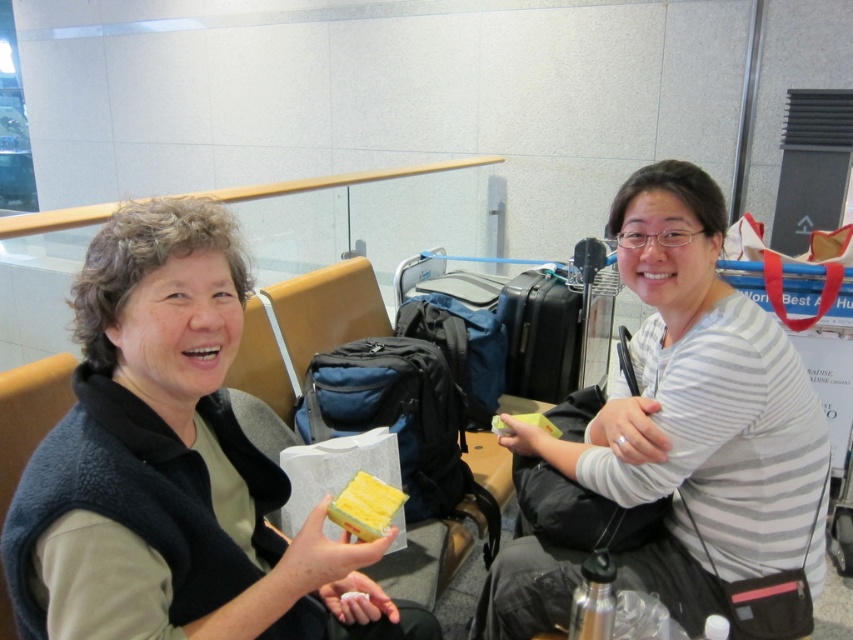
Question: Is matte black vest at left to the left of yellow matte soap at center from the viewer's perspective?

Choices:
 (A) no
 (B) yes

Answer: (B)

Question: Among these points, which one is farthest from the camera?

Choices:
 (A) (563, 346)
 (B) (585, 524)

Answer: (A)

Question: Is blue fabric backpack at center in front of yellow matte soap at center?

Choices:
 (A) no
 (B) yes

Answer: (A)

Question: Which object appears farthest from the camera in this image?

Choices:
 (A) matte black vest at left
 (B) yellow matte soap at center
 (C) black fabric backpack at right
 (D) black hard suitcase at center

Answer: (D)

Question: Is white striped shirt at center closer to camera compared to blue fabric backpack at center?

Choices:
 (A) yes
 (B) no

Answer: (A)

Question: Which is farther from the white striped shirt at center?

Choices:
 (A) black fabric backpack at right
 (B) matte black vest at left
 (C) black hard suitcase at center

Answer: (C)